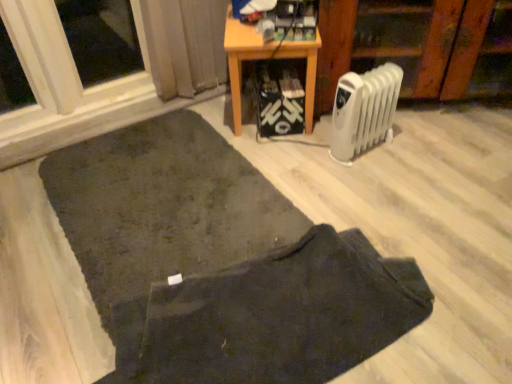
Measure the distance between point (475,64) and camera.

6.61 feet.

This screenshot has width=512, height=384. Describe the element at coordinates (364, 111) in the screenshot. I see `white plastic radiator at lower right` at that location.

Describe the element at coordinates (272, 316) in the screenshot. The height and width of the screenshot is (384, 512). I see `dark fabric doormat at lower center` at that location.

This screenshot has width=512, height=384. I want to click on dark fabric doormat at lower center, so click(x=272, y=316).

The width and height of the screenshot is (512, 384). Identify the location of white plastic radiator at center-right. (416, 44).

Is white plastic radiator at lower right far from dark fabric mat at lower center?

They are positioned close to each other.

From a real-world perspective, is white plastic radiator at lower right above or below dark fabric mat at lower center?

From a real-world perspective, white plastic radiator at lower right is physically above dark fabric mat at lower center.

Is white plastic radiator at lower right behind dark fabric mat at lower center?

Yes, it is behind dark fabric mat at lower center.

Does white plastic radiator at lower right appear on the left side of dark fabric mat at lower center?

Incorrect, white plastic radiator at lower right is not on the left side of dark fabric mat at lower center.

From the image's perspective, is dark fabric mat at lower center on white plastic radiator at center-right?

Incorrect, from the image's perspective, dark fabric mat at lower center is lower than white plastic radiator at center-right.

Which of these two, dark fabric mat at lower center or white plastic radiator at center-right, is thinner?

white plastic radiator at center-right.

Is white plastic radiator at lower right facing towards dark fabric doormat at lower center?

No, white plastic radiator at lower right does not turn towards dark fabric doormat at lower center.

Can you confirm if white plastic radiator at lower right is taller than dark fabric doormat at lower center?

Yes.

Consider the image. Which object is closer to the camera, white plastic radiator at lower right or dark fabric doormat at lower center?

Positioned in front is dark fabric doormat at lower center.

From the image's perspective, is white plastic radiator at lower right below dark fabric doormat at lower center?

Actually, white plastic radiator at lower right appears above dark fabric doormat at lower center in the image.

Is white plastic radiator at center-right positioned with its back to dark fabric mat at lower center?

white plastic radiator at center-right is not turned away from dark fabric mat at lower center.

From the image's perspective, which is above, white plastic radiator at center-right or dark fabric mat at lower center?

From the image's view, white plastic radiator at center-right is above.

Is white plastic radiator at center-right wider or thinner than dark fabric mat at lower center?

Clearly, white plastic radiator at center-right has less width compared to dark fabric mat at lower center.

Is white plastic radiator at center-right to the left of dark fabric mat at lower center from the viewer's perspective?

→ Incorrect, white plastic radiator at center-right is not on the left side of dark fabric mat at lower center.

Consider the image. Does dark fabric doormat at lower center have a lesser height compared to white plastic radiator at center-right?

Indeed, dark fabric doormat at lower center has a lesser height compared to white plastic radiator at center-right.

Looking at their sizes, would you say dark fabric doormat at lower center is wider or thinner than white plastic radiator at center-right?

In the image, dark fabric doormat at lower center appears to be more narrow than white plastic radiator at center-right.

In the scene shown: Is dark fabric doormat at lower center completely or partially outside of white plastic radiator at center-right?

Yes, dark fabric doormat at lower center is not within white plastic radiator at center-right.

From the image's perspective, which object appears higher, dark fabric doormat at lower center or white plastic radiator at center-right?

From the image's view, white plastic radiator at center-right is above.

Is white plastic radiator at lower right bigger or smaller than white plastic radiator at center-right?

Considering their sizes, white plastic radiator at lower right takes up less space than white plastic radiator at center-right.

Who is more distant, white plastic radiator at lower right or white plastic radiator at center-right?

white plastic radiator at center-right.

In the scene shown: Which is closer to the camera, (333, 132) or (475, 91)?

Point (333, 132) is closer to the camera than point (475, 91).

Is point (287, 43) closer to camera compared to point (349, 40)?

Yes, it is in front of point (349, 40).

Considering the relative sizes of wooden table at center and white plastic radiator at center-right in the image provided, is wooden table at center shorter than white plastic radiator at center-right?

Yes, wooden table at center is shorter than white plastic radiator at center-right.

Considering their positions, is wooden table at center located in front of or behind white plastic radiator at center-right?

In the image, wooden table at center appears behind white plastic radiator at center-right.

From the image's perspective, between wooden table at center and white plastic radiator at center-right, which one is located above?

white plastic radiator at center-right appears higher in the image.

Find the location of a particular element. The width and height of the screenshot is (512, 384). mat in front of the white plastic radiator at lower right is located at coordinates (162, 206).

The image size is (512, 384). I want to click on furniture located behind the dark fabric mat at lower center, so click(416, 44).

Looking at the image, which one is located further to white plastic radiator at center-right, white plastic radiator at lower right or dark fabric doormat at lower center?

dark fabric doormat at lower center.

In the scene shown: When comparing their distances from white plastic radiator at center-right, does white plastic radiator at lower right or wooden table at center seem further?

Based on the image, wooden table at center appears to be further to white plastic radiator at center-right.

Looking at the image, which one is located closer to white plastic radiator at lower right, dark fabric mat at lower center or wooden table at center?

Among the two, wooden table at center is located nearer to white plastic radiator at lower right.

Looking at the image, which one is located closer to dark fabric mat at lower center, dark fabric doormat at lower center or white plastic radiator at center-right?

dark fabric doormat at lower center is positioned closer to the anchor dark fabric mat at lower center.

From the image, which object appears to be nearer to wooden table at center, white plastic radiator at lower right or dark fabric mat at lower center?

Based on the image, white plastic radiator at lower right appears to be nearer to wooden table at center.

Which object lies nearer to the anchor point white plastic radiator at lower right, white plastic radiator at center-right or wooden table at center?

Based on the image, wooden table at center appears to be nearer to white plastic radiator at lower right.

Based on their spatial positions, is white plastic radiator at lower right or white plastic radiator at center-right further from wooden table at center?

white plastic radiator at center-right is further to wooden table at center.

When comparing their distances from dark fabric doormat at lower center, does wooden table at center or white plastic radiator at lower right seem closer?

white plastic radiator at lower right is positioned closer to the anchor dark fabric doormat at lower center.

What are the coordinates of `radiator between wooden table at center and white plastic radiator at center-right in the horizontal direction` in the screenshot? It's located at (364, 111).

The height and width of the screenshot is (384, 512). What are the coordinates of `radiator between wooden table at center and dark fabric doormat at lower center from top to bottom` in the screenshot? It's located at (364, 111).

The image size is (512, 384). Find the location of `doormat located between dark fabric mat at lower center and white plastic radiator at lower right in the left-right direction`. doormat located between dark fabric mat at lower center and white plastic radiator at lower right in the left-right direction is located at coordinates (272, 316).

At what (x,y) coordinates should I click in order to perform the action: click on table between dark fabric mat at lower center and white plastic radiator at lower right in the horizontal direction. Please return your answer as a coordinate pair (x, y). This screenshot has height=384, width=512. Looking at the image, I should click on (266, 59).